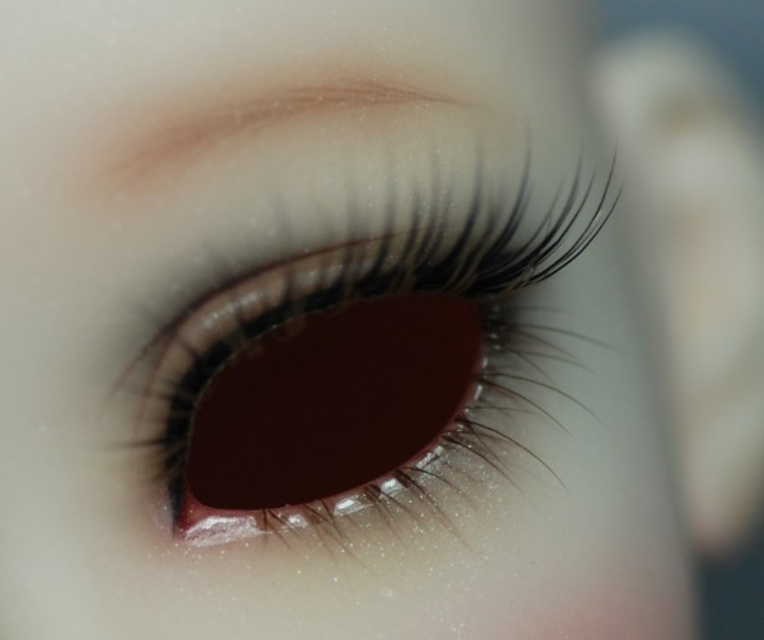
Does shiny brown contact lens at center appear on the left side of matte brown eyebrow at upper center?

No, shiny brown contact lens at center is not to the left of matte brown eyebrow at upper center.

Is point (536, 348) positioned in front of point (199, 161)?

That is False.

The width and height of the screenshot is (764, 640). In order to click on shiny brown contact lens at center in this screenshot , I will do `click(358, 333)`.